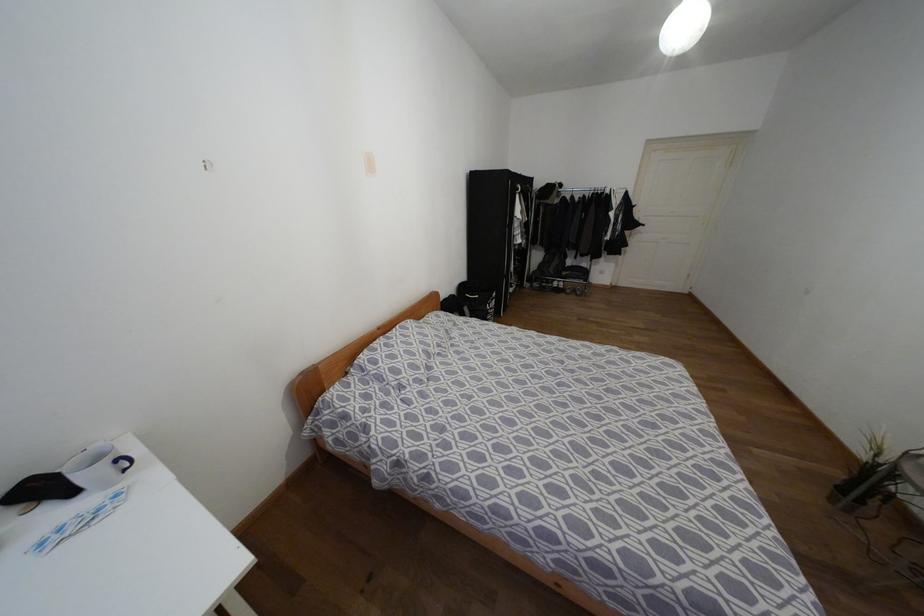
In order to click on white mug handle in this screenshot , I will do `click(123, 463)`.